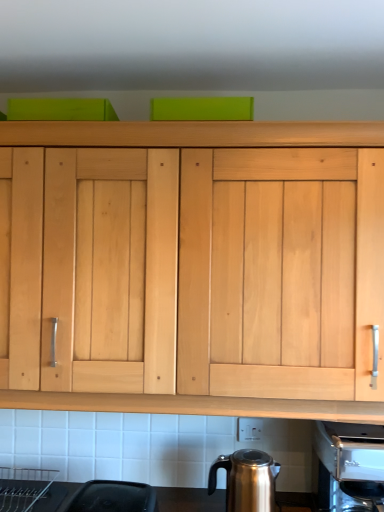
Question: Considering the relative sizes of satin silver coffee machine at lower right and shiny metallic kettle at lower center in the image provided, is satin silver coffee machine at lower right wider than shiny metallic kettle at lower center?

Choices:
 (A) no
 (B) yes

Answer: (B)

Question: Can you confirm if satin silver coffee machine at lower right is positioned to the right of shiny metallic kettle at lower center?

Choices:
 (A) no
 (B) yes

Answer: (B)

Question: Is satin silver coffee machine at lower right located outside shiny metallic kettle at lower center?

Choices:
 (A) yes
 (B) no

Answer: (A)

Question: Does satin silver coffee machine at lower right have a smaller size compared to shiny metallic kettle at lower center?

Choices:
 (A) yes
 (B) no

Answer: (B)

Question: Could shiny metallic kettle at lower center be considered to be inside satin silver coffee machine at lower right?

Choices:
 (A) no
 (B) yes

Answer: (A)

Question: From a real-world perspective, is satin silver coffee machine at lower right located beneath shiny metallic kettle at lower center?

Choices:
 (A) no
 (B) yes

Answer: (A)

Question: Does shiny metallic kettle at lower center have a lesser width compared to satin silver coffee machine at lower right?

Choices:
 (A) yes
 (B) no

Answer: (A)

Question: Is shiny metallic kettle at lower center behind satin silver coffee machine at lower right?

Choices:
 (A) yes
 (B) no

Answer: (A)

Question: From a real-world perspective, is shiny metallic kettle at lower center under satin silver coffee machine at lower right?

Choices:
 (A) no
 (B) yes

Answer: (B)

Question: Does shiny metallic kettle at lower center appear on the left side of satin silver coffee machine at lower right?

Choices:
 (A) no
 (B) yes

Answer: (B)

Question: Considering the relative sizes of shiny metallic kettle at lower center and satin silver coffee machine at lower right in the image provided, is shiny metallic kettle at lower center shorter than satin silver coffee machine at lower right?

Choices:
 (A) yes
 (B) no

Answer: (A)

Question: From the image's perspective, is shiny metallic kettle at lower center on satin silver coffee machine at lower right?

Choices:
 (A) no
 (B) yes

Answer: (A)

Question: Visually, is satin silver coffee machine at lower right positioned to the left or to the right of shiny metallic kettle at lower center?

Choices:
 (A) left
 (B) right

Answer: (B)